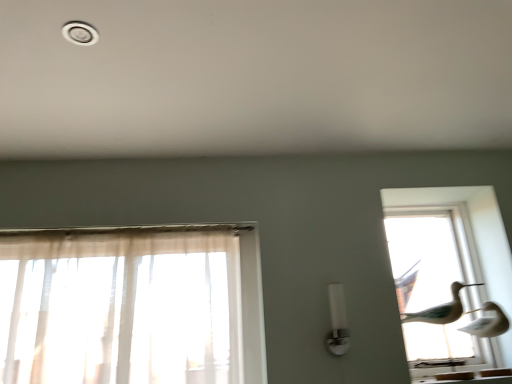
Question: Is transparent glass birds at right closer to camera compared to white glossy light fixture at center?

Choices:
 (A) yes
 (B) no

Answer: (B)

Question: Is transparent glass birds at right facing towards white glossy light fixture at center?

Choices:
 (A) yes
 (B) no

Answer: (B)

Question: Can you confirm if transparent glass birds at right is shorter than white glossy light fixture at center?

Choices:
 (A) no
 (B) yes

Answer: (A)

Question: Is transparent glass birds at right at the right side of white glossy light fixture at center?

Choices:
 (A) no
 (B) yes

Answer: (B)

Question: Are transparent glass birds at right and white glossy light fixture at center making contact?

Choices:
 (A) yes
 (B) no

Answer: (B)

Question: From a real-world perspective, does transparent glass birds at right sit lower than white glossy light fixture at center?

Choices:
 (A) yes
 (B) no

Answer: (B)

Question: Is white plastic light fixture at upper left bigger than white glossy light fixture at center?

Choices:
 (A) yes
 (B) no

Answer: (B)

Question: From the image's perspective, is white plastic light fixture at upper left under white glossy light fixture at center?

Choices:
 (A) no
 (B) yes

Answer: (A)

Question: Does white plastic light fixture at upper left have a greater width compared to white glossy light fixture at center?

Choices:
 (A) no
 (B) yes

Answer: (B)

Question: Considering the relative sizes of white plastic light fixture at upper left and white glossy light fixture at center in the image provided, is white plastic light fixture at upper left taller than white glossy light fixture at center?

Choices:
 (A) yes
 (B) no

Answer: (B)

Question: From a real-world perspective, is white plastic light fixture at upper left below white glossy light fixture at center?

Choices:
 (A) yes
 (B) no

Answer: (B)

Question: Is white plastic light fixture at upper left looking in the opposite direction of white glossy light fixture at center?

Choices:
 (A) yes
 (B) no

Answer: (B)

Question: From the image's perspective, is white glossy light fixture at center under white plastic light fixture at upper left?

Choices:
 (A) no
 (B) yes

Answer: (B)